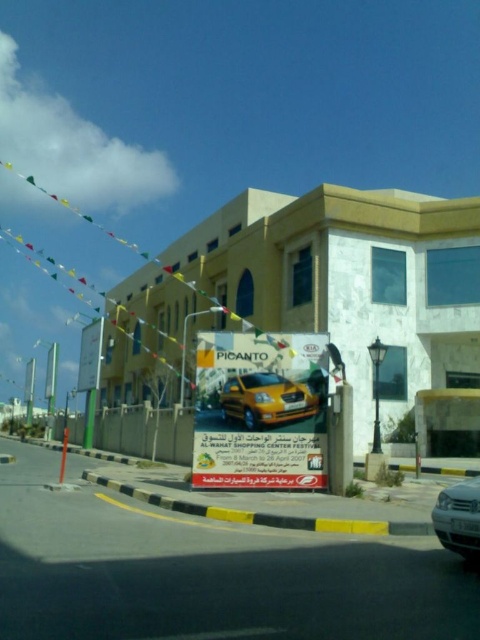
Question: Among these objects, which one is nearest to the camera?

Choices:
 (A) silver metallic car at lower right
 (B) yellow matte car at center
 (C) yellow glossy car at center

Answer: (A)

Question: Is yellow glossy car at center to the left of yellow matte car at center from the viewer's perspective?

Choices:
 (A) yes
 (B) no

Answer: (A)

Question: Which point is farther to the camera?

Choices:
 (A) (308, 472)
 (B) (283, 417)
 (C) (456, 483)

Answer: (C)

Question: Is yellow matte car at center wider than silver metallic car at lower right?

Choices:
 (A) no
 (B) yes

Answer: (B)

Question: Which object appears farthest from the camera in this image?

Choices:
 (A) silver metallic car at lower right
 (B) yellow glossy car at center

Answer: (B)

Question: Is yellow glossy car at center to the left of yellow matte car at center from the viewer's perspective?

Choices:
 (A) no
 (B) yes

Answer: (B)